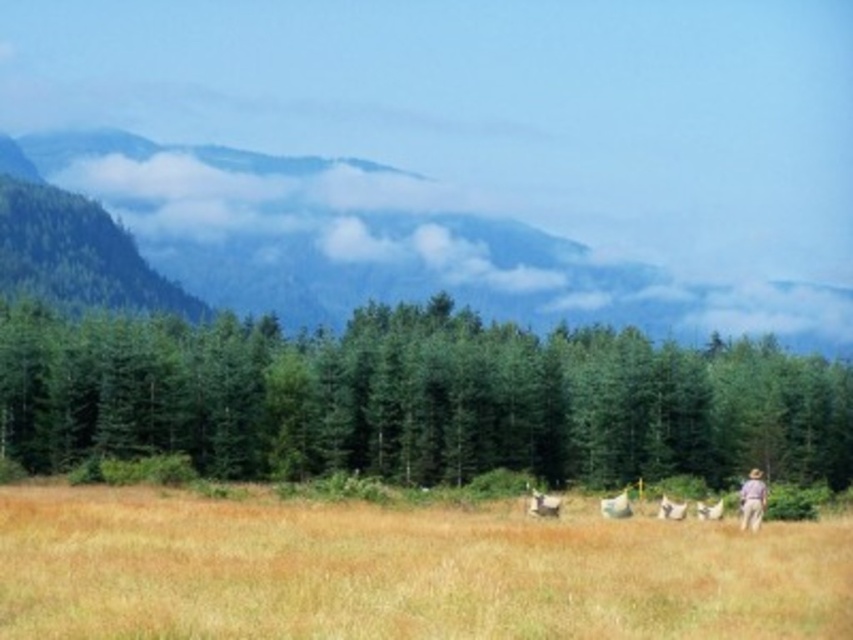
Question: Which point is closer to the camera?

Choices:
 (A) (206, 532)
 (B) (746, 492)

Answer: (A)

Question: Which object is positioned closest to the brown grassy pasture at lower center?

Choices:
 (A) green textured trees at center
 (B) white fluffy sheep at lower right
 (C) white fluffy sheep at lower center
 (D) green forested mountain at upper left

Answer: (B)

Question: Is green textured trees at center wider than white fluffy sheep at lower center?

Choices:
 (A) yes
 (B) no

Answer: (A)

Question: Can you confirm if purple cotton shirt at lower right is smaller than white fluffy sheep at center?

Choices:
 (A) yes
 (B) no

Answer: (B)

Question: Which object appears farthest from the camera in this image?

Choices:
 (A) green textured trees at center
 (B) white fluffy sheep at lower center
 (C) white fluffy sheep at center

Answer: (A)

Question: Is brown grassy pasture at lower center smaller than white fluffy sheep at center?

Choices:
 (A) yes
 (B) no

Answer: (B)